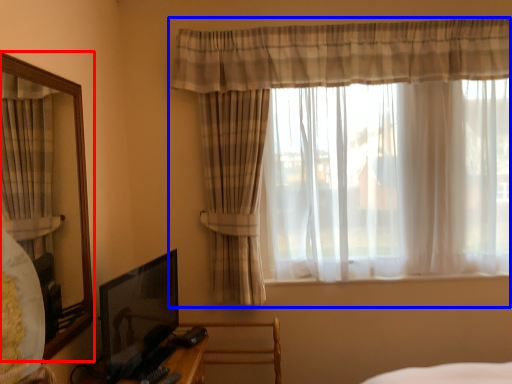
Question: Which of the following is the farthest to the observer, mirror (highlighted by a red box) or curtain (highlighted by a blue box)?

Choices:
 (A) mirror
 (B) curtain

Answer: (B)